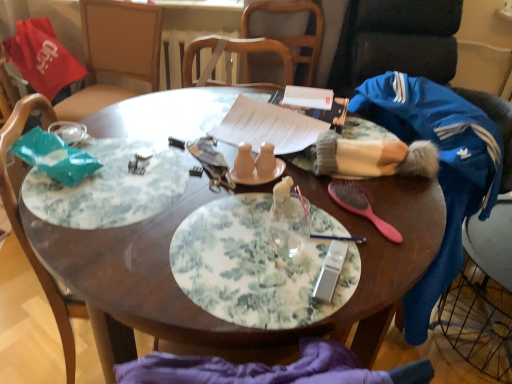
Where is `vacant space in front of metallic silver pen at center, which appears as the fourth tableware when viewed from the left`? The height and width of the screenshot is (384, 512). vacant space in front of metallic silver pen at center, which appears as the fourth tableware when viewed from the left is located at coordinates (332, 283).